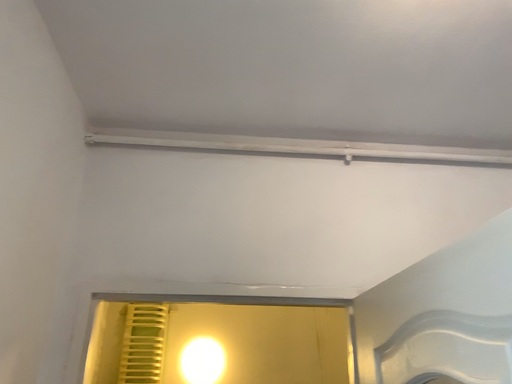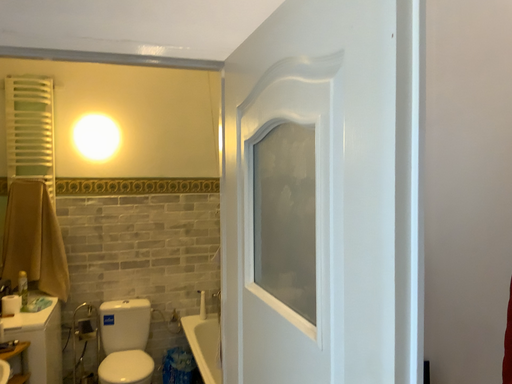
Question: How did the camera likely rotate when shooting the video?

Choices:
 (A) rotated right
 (B) rotated left

Answer: (A)